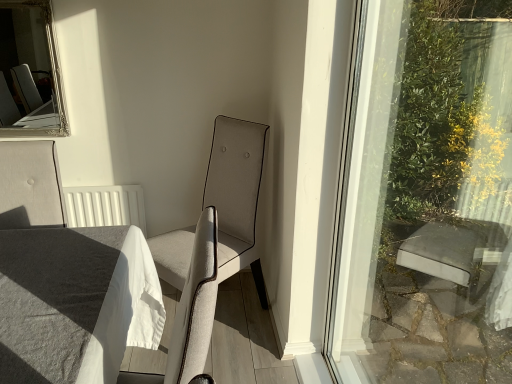
Question: From a real-world perspective, is light beige fabric chair at center above or below white linen table at lower left?

Choices:
 (A) above
 (B) below

Answer: (B)

Question: In the image, is light beige fabric chair at center positioned in front of or behind white linen table at lower left?

Choices:
 (A) front
 (B) behind

Answer: (B)

Question: Which is nearer to the silver/gilded mirror at upper left?

Choices:
 (A) white linen table at lower left
 (B) light beige fabric chair at center

Answer: (B)

Question: Which object is the farthest from the silver/gilded mirror at upper left?

Choices:
 (A) white linen table at lower left
 (B) light beige fabric chair at center

Answer: (A)